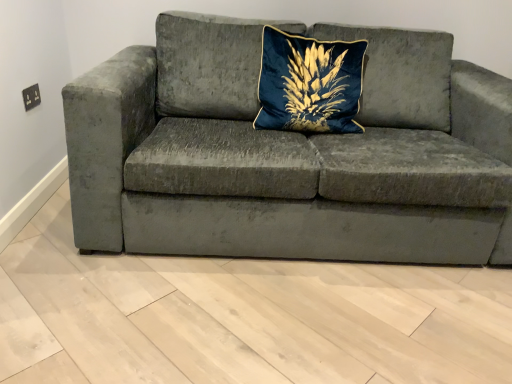
What do you see at coordinates (309, 83) in the screenshot? I see `velvet blue pillow at center` at bounding box center [309, 83].

Identify the location of velvet blue pillow at center. The width and height of the screenshot is (512, 384). coord(309,83).

This screenshot has height=384, width=512. What do you see at coordinates (289, 153) in the screenshot?
I see `velvet gray couch at center` at bounding box center [289, 153].

What is the approximate height of velvet gray couch at center?

The height of velvet gray couch at center is 32.66 inches.

At what (x,y) coordinates should I click in order to perform the action: click on velvet gray couch at center. Please return your answer as a coordinate pair (x, y). Looking at the image, I should click on (289, 153).

The width and height of the screenshot is (512, 384). What are the coordinates of `velvet blue pillow at center` in the screenshot? It's located at (309, 83).

Between velvet blue pillow at center and velvet gray couch at center, which one appears on the right side from the viewer's perspective?

Positioned to the right is velvet blue pillow at center.

Who is more distant, velvet blue pillow at center or velvet gray couch at center?

velvet blue pillow at center is further from the camera.

Considering the points (295, 96) and (378, 82), which point is in front, point (295, 96) or point (378, 82)?

The point (295, 96) is in front.

Consider the image. From the image's perspective, is velvet blue pillow at center positioned above or below velvet gray couch at center?

From the image's perspective, velvet blue pillow at center appears above velvet gray couch at center.

From a real-world perspective, is velvet blue pillow at center located higher than velvet gray couch at center?

Correct, in the physical world, velvet blue pillow at center is higher than velvet gray couch at center.

Considering the relative sizes of velvet blue pillow at center and velvet gray couch at center in the image provided, is velvet blue pillow at center wider than velvet gray couch at center?

No, velvet blue pillow at center is not wider than velvet gray couch at center.

Considering the relative sizes of velvet blue pillow at center and velvet gray couch at center in the image provided, is velvet blue pillow at center taller than velvet gray couch at center?

Incorrect, the height of velvet blue pillow at center is not larger of that of velvet gray couch at center.

In terms of size, does velvet blue pillow at center appear bigger or smaller than velvet gray couch at center?

Considering their sizes, velvet blue pillow at center takes up less space than velvet gray couch at center.

Is velvet blue pillow at center not inside velvet gray couch at center?

No.

Is velvet blue pillow at center far away from velvet gray couch at center?

No.

Is velvet blue pillow at center facing away from velvet gray couch at center?

Absolutely, velvet blue pillow at center is directed away from velvet gray couch at center.

You are a GUI agent. You are given a task and a screenshot of the screen. Output one action in this format:
    pyautogui.click(x=<x>, y=<y>)
    Task: Click on the studio couch that is in front of the velvet blue pillow at center
    
    Given the screenshot: What is the action you would take?
    pyautogui.click(x=289, y=153)

Is velvet gray couch at center at the right side of velvet blue pillow at center?

No.

Is velvet gray couch at center positioned in front of velvet blue pillow at center?

Yes, it is in front of velvet blue pillow at center.

Which is in front, point (106, 71) or point (295, 112)?

The point (106, 71) is closer to the camera.

From the image's perspective, is velvet gray couch at center above or below velvet blue pillow at center?

Based on their image positions, velvet gray couch at center is located beneath velvet blue pillow at center.

From a real-world perspective, is velvet gray couch at center physically located above or below velvet blue pillow at center?

velvet gray couch at center is below velvet blue pillow at center.

Between velvet gray couch at center and velvet blue pillow at center, which one has smaller width?

velvet blue pillow at center is thinner.

Who is shorter, velvet gray couch at center or velvet blue pillow at center?

velvet blue pillow at center.

Which of these two, velvet gray couch at center or velvet blue pillow at center, is bigger?

With larger size is velvet gray couch at center.

Do you think velvet gray couch at center is within velvet blue pillow at center, or outside of it?

velvet gray couch at center is not inside velvet blue pillow at center, it's outside.

Is velvet gray couch at center positioned far away from velvet blue pillow at center?

They are positioned close to each other.

Is velvet gray couch at center aimed at velvet blue pillow at center?

Yes.

I want to click on pillow located on the right of velvet gray couch at center, so click(x=309, y=83).

Locate an element on the screen. This screenshot has width=512, height=384. pillow above the velvet gray couch at center (from the image's perspective) is located at coordinates (309, 83).

Locate an element on the screen. The height and width of the screenshot is (384, 512). pillow that is above the velvet gray couch at center (from a real-world perspective) is located at coordinates (309, 83).